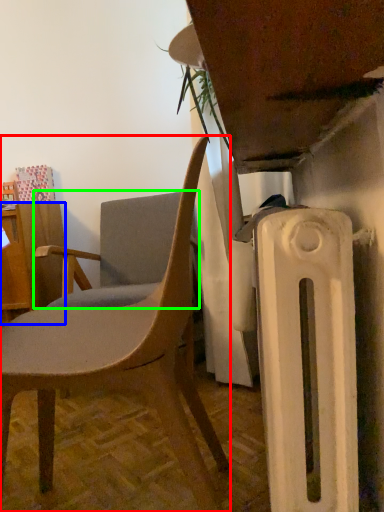
Question: Which is farther away from chair (highlighted by a red box)? desk (highlighted by a blue box) or chair (highlighted by a green box)?

Choices:
 (A) desk
 (B) chair

Answer: (A)